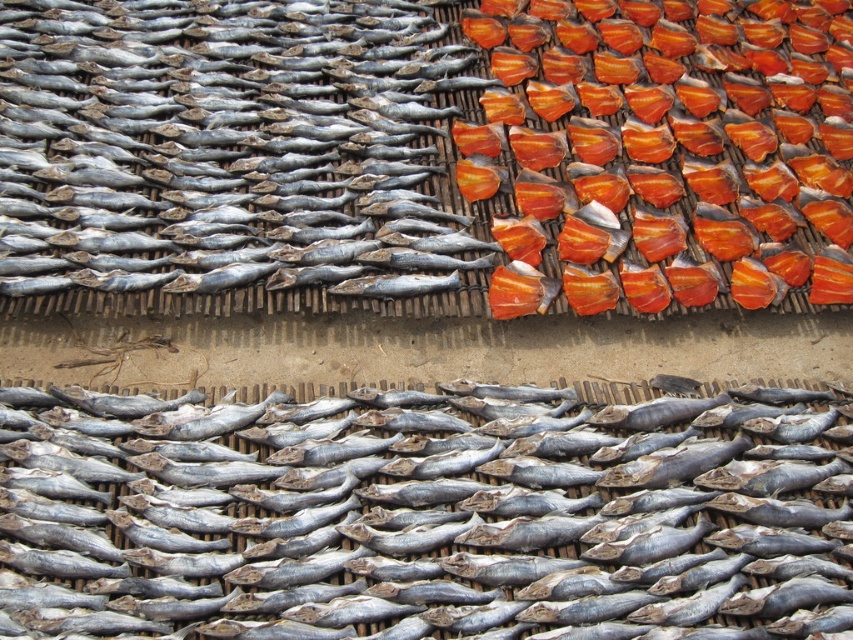
Question: Among these points, which one is farthest from the camera?

Choices:
 (A) (828, 284)
 (B) (194, 99)

Answer: (B)

Question: Does silvery matte fish at upper left have a smaller size compared to orange-red dried fish at upper right?

Choices:
 (A) yes
 (B) no

Answer: (A)

Question: Which point is closer to the camera taking this photo?

Choices:
 (A) (738, 147)
 (B) (569, 454)
 (C) (103, 45)

Answer: (B)

Question: Which of the following is the farthest from the observer?

Choices:
 (A) coord(827,276)
 (B) coord(3,6)
 (C) coord(830,625)

Answer: (B)

Question: Observing the image, what is the correct spatial positioning of grayish matte fish at center in reference to silvery matte fish at upper left?

Choices:
 (A) below
 (B) above

Answer: (A)

Question: Is grayish matte fish at center above orange-red dried fish at upper right?

Choices:
 (A) yes
 (B) no

Answer: (B)